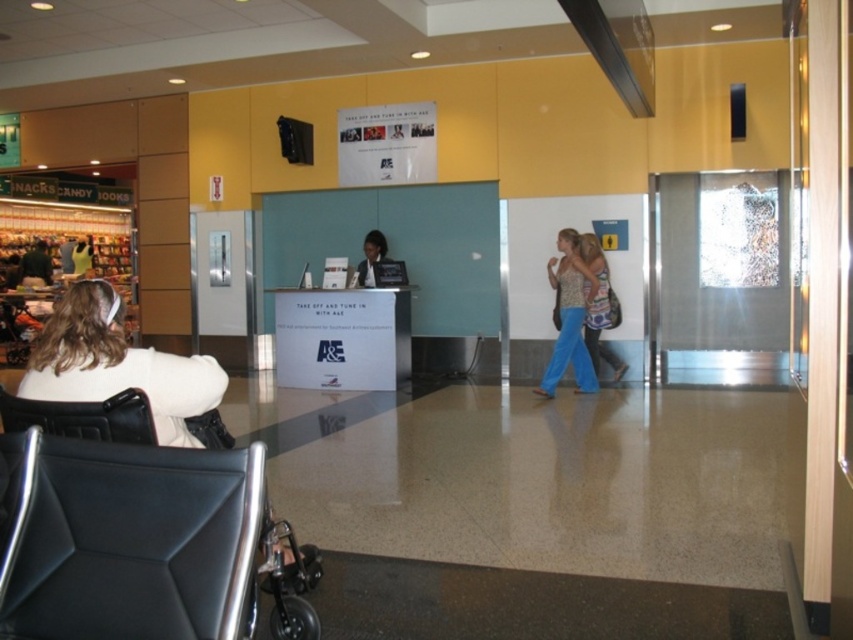
Based on the photo, you are navigating an airport terminal and need to sit down. You see a black wheelchair with a silver frame facing away from you and a black leather chair at lower left. Which chair is closer to your current position if you are standing at the entrance near the counter?

The black leather chair at lower left is closer to your current position since it is located at point (83, 417), which is nearer to the entrance area compared to the wheelchair positioned further away.

You are designing a layout for a small office and need to place both the black leather swivel chair at lower left and the patterned fabric dress at center. Given their sizes, which object should you prioritize placing first to ensure they both fit comfortably?

The black leather swivel chair at lower left occupies less space than the patterned fabric dress at center, so you should prioritize placing the patterned fabric dress at center first to ensure there is enough space for it, then fit the smaller chair around it.